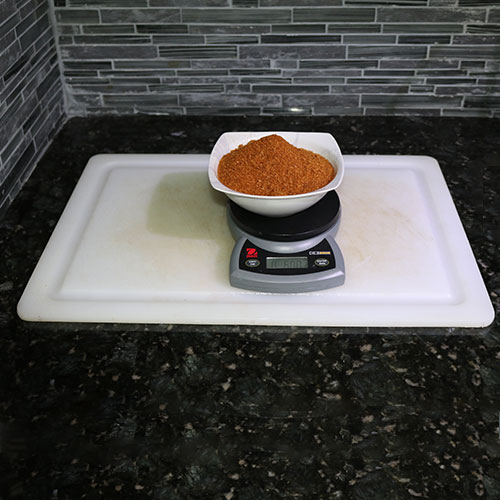
Find the location of a particular element. This screenshot has height=500, width=500. reflection from kitchen light is located at coordinates (294, 111), (336, 272), (288, 249).